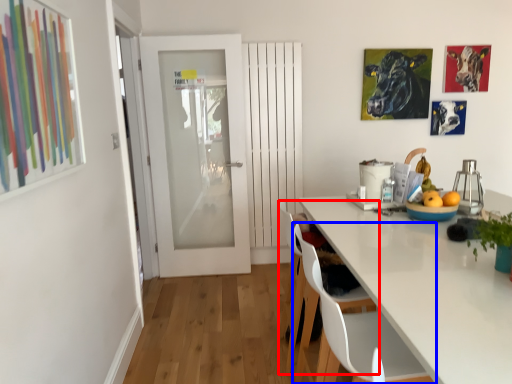
Question: Which of the following is the closest to the observer, chair (highlighted by a red box) or chair (highlighted by a blue box)?

Choices:
 (A) chair
 (B) chair

Answer: (B)